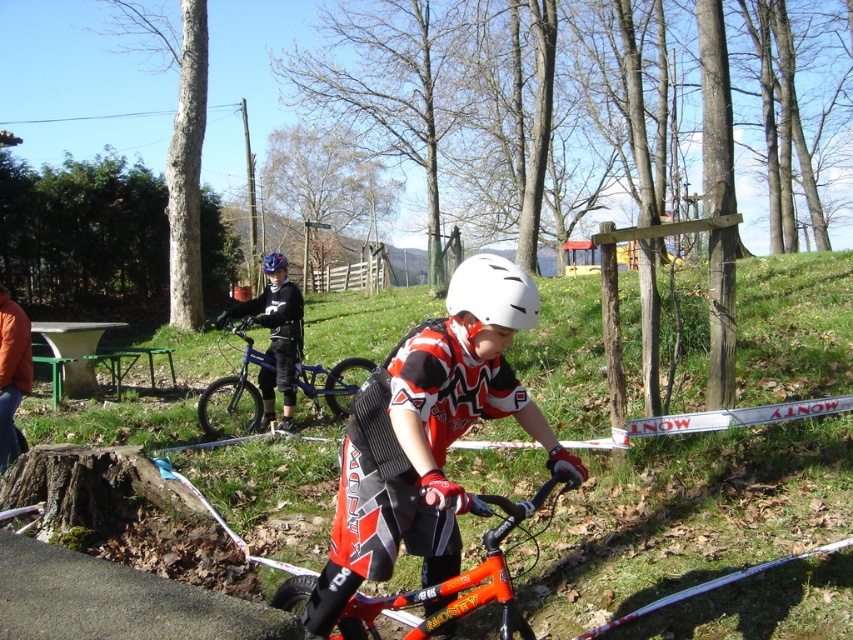
Question: Does orange matte mountain bike at center lie behind blue metallic bicycle at center?

Choices:
 (A) yes
 (B) no

Answer: (B)

Question: Is blue metallic bicycle at center closer to the viewer compared to white matte helmet at center?

Choices:
 (A) yes
 (B) no

Answer: (B)

Question: Which point appears farthest from the camera in this image?

Choices:
 (A) (444, 595)
 (B) (418, 474)

Answer: (A)

Question: Which is farther from the white matte helmet at center?

Choices:
 (A) blue matte helmet at center
 (B) orange matte bicycle at center
 (C) orange matte mountain bike at center

Answer: (A)

Question: Which point is closer to the camera?

Choices:
 (A) white matte helmet at center
 (B) blue metallic bicycle at center

Answer: (A)

Question: Does orange matte bicycle at center appear on the right side of orange matte mountain bike at center?

Choices:
 (A) no
 (B) yes

Answer: (B)